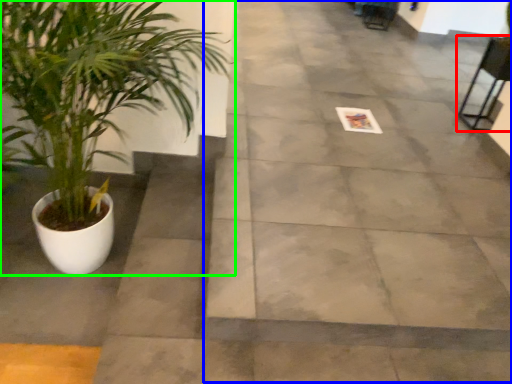
Question: Which object is positioned closest to chair (highlighted by a red box)? Select from pavement (highlighted by a blue box) and houseplant (highlighted by a green box).

Choices:
 (A) pavement
 (B) houseplant

Answer: (A)